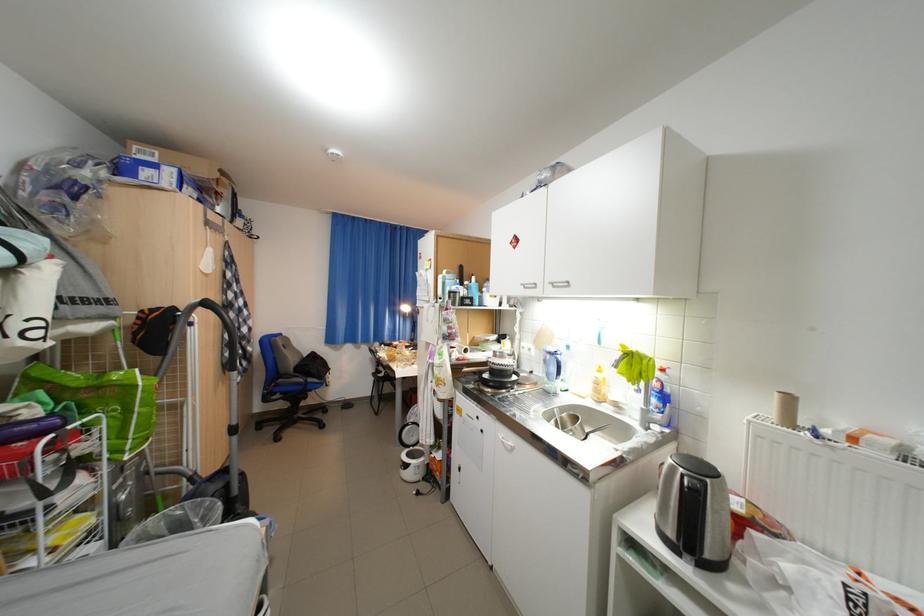
The height and width of the screenshot is (616, 924). What are the coordinates of `black chair armrest` in the screenshot? It's located at (285, 362).